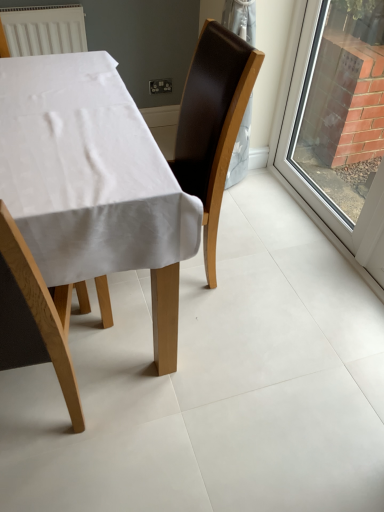
You are a GUI agent. You are given a task and a screenshot of the screen. Output one action in this format:
    pyautogui.click(x=<x>, y=<y>)
    Task: Click on the free space that is in between white fabric-covered table at center and wooden chair at lower left, which is counted as the second chair, starting from the back
    
    Given the screenshot: What is the action you would take?
    pyautogui.click(x=129, y=414)